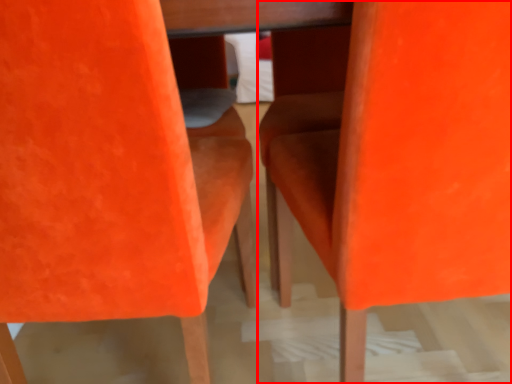
Question: Observing the image, what is the correct spatial positioning of chair (annotated by the red box) in reference to chair?

Choices:
 (A) left
 (B) right

Answer: (B)